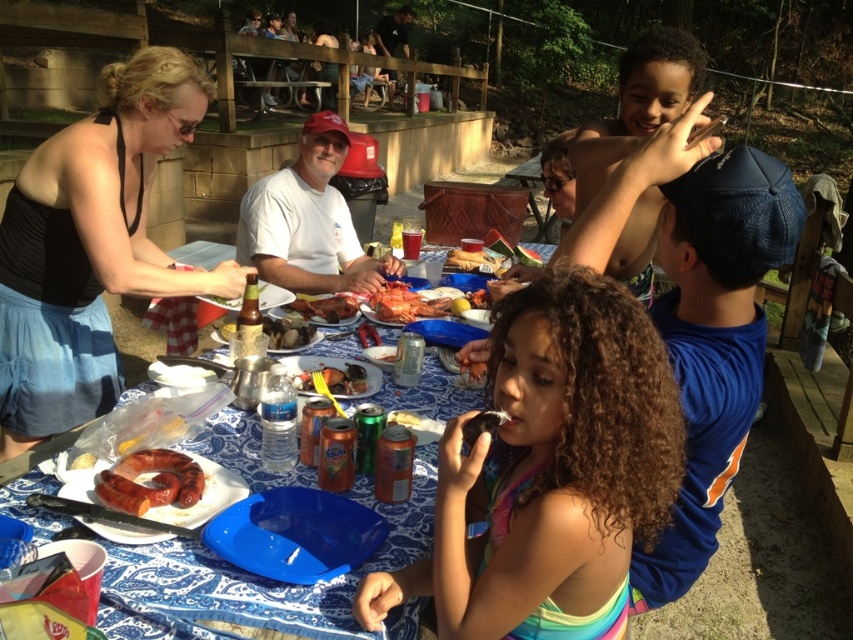
Question: Which point appears farthest from the camera in this image?

Choices:
 (A) (473, 540)
 (B) (383, 298)
 (C) (242, 429)
 (D) (454, 269)

Answer: (D)

Question: Is rainbow fabric dress at center bigger than brown glossy sausage at lower left?

Choices:
 (A) no
 (B) yes

Answer: (B)

Question: Which object is farther from the camera taking this photo?

Choices:
 (A) shiny plastic fork at center
 (B) white paper plate at center
 (C) brown glossy sausage at lower left

Answer: (A)

Question: Can you confirm if blue fabric table at center is thinner than shiny orange lobster at center?

Choices:
 (A) no
 (B) yes

Answer: (A)

Question: Can you confirm if brown glossy sausage at lower left is positioned below golden crispy chicken at center?

Choices:
 (A) no
 (B) yes

Answer: (B)

Question: Among these points, which one is nearest to the camera?

Choices:
 (A) (282, 266)
 (B) (265, 316)

Answer: (B)